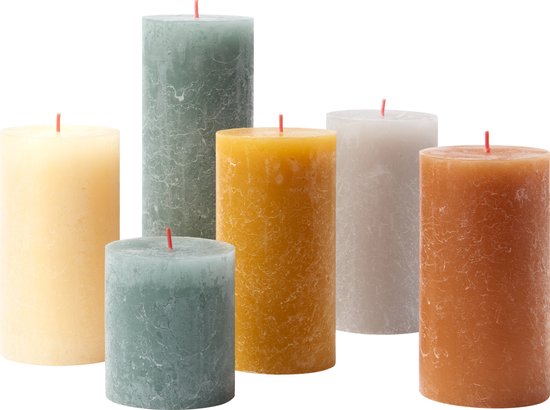
At what (x,y) coordinates should I click in order to perform the action: click on candles. Please return your answer as a coordinate pair (x, y). Looking at the image, I should click on (50, 224), (154, 101), (142, 316), (251, 245), (377, 194), (459, 268).